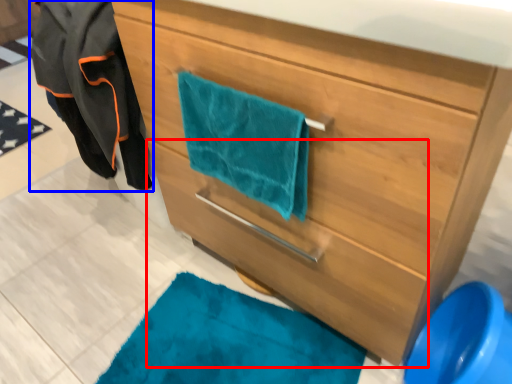
Question: Which object appears farthest to the camera in this image, drawer (highlighted by a red box) or jacket (highlighted by a blue box)?

Choices:
 (A) drawer
 (B) jacket

Answer: (B)